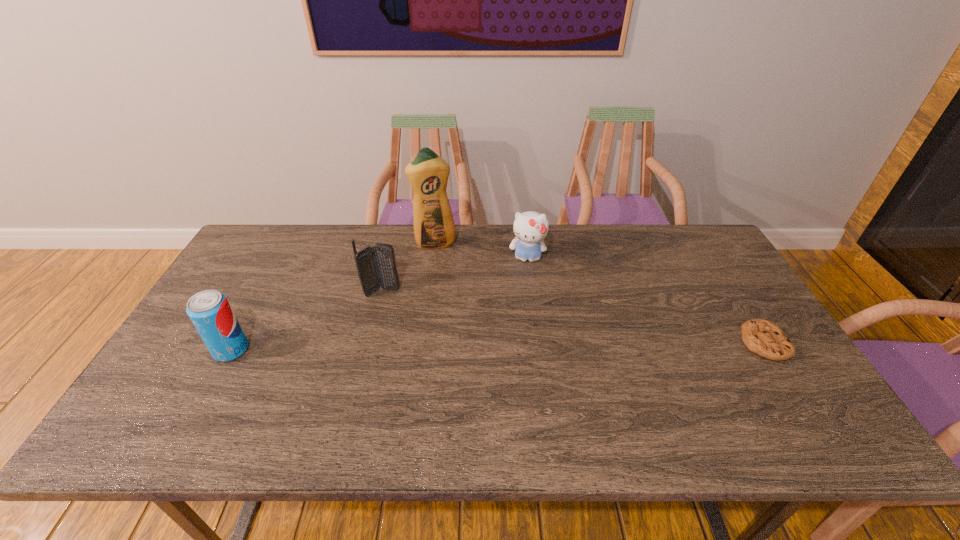
At what (x,y) coordinates should I click in order to perform the action: click on vacant position located on the label of the tallest object. Please return your answer as a coordinate pair (x, y). Looking at the image, I should click on (456, 309).

Where is `vacant area located on the label of the tallest object`? Image resolution: width=960 pixels, height=540 pixels. vacant area located on the label of the tallest object is located at coordinates (448, 282).

Find the location of a particular element. The image size is (960, 540). free space located 0.300m on the label of the tallest object is located at coordinates (458, 314).

Where is `vacant region located 0.160m on the front-facing side of the second object from right to left`? The height and width of the screenshot is (540, 960). vacant region located 0.160m on the front-facing side of the second object from right to left is located at coordinates (525, 303).

Identify the location of vacant space located on the front-facing side of the second object from right to left. This screenshot has width=960, height=540. (521, 370).

Locate an element on the screen. free space located 0.400m on the front-facing side of the second object from right to left is located at coordinates pyautogui.click(x=521, y=370).

The height and width of the screenshot is (540, 960). Find the location of `vacant position located 0.100m on the keyboard of the second object from left to right`. vacant position located 0.100m on the keyboard of the second object from left to right is located at coordinates (418, 312).

This screenshot has height=540, width=960. I want to click on free space located on the keyboard of the second object from left to right, so click(460, 340).

This screenshot has width=960, height=540. What are the coordinates of `free space located 0.300m on the keyboard of the second object from left to right` in the screenshot? It's located at (471, 347).

Image resolution: width=960 pixels, height=540 pixels. I want to click on detergent at the far edge, so click(434, 228).